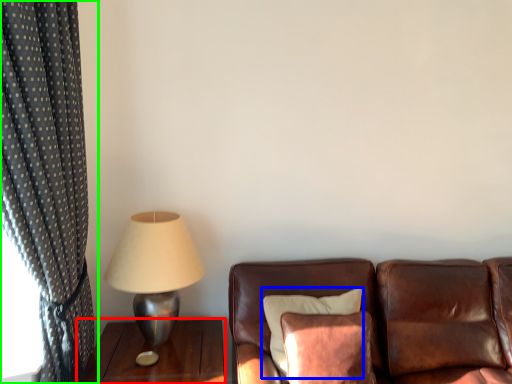
Question: Based on their relative distances, which object is farther from table (highlighted by a red box)? Choose from pillow (highlighted by a blue box) and curtain (highlighted by a green box).

Choices:
 (A) pillow
 (B) curtain

Answer: (B)